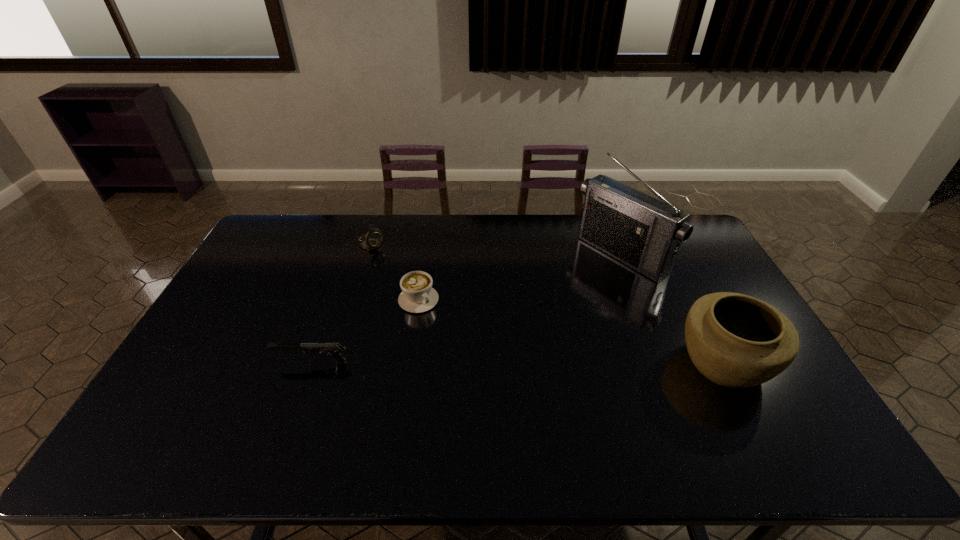
This screenshot has height=540, width=960. I want to click on object that is at the near edge, so click(735, 340).

Find the location of `object situated at the right edge`. object situated at the right edge is located at coordinates (735, 340).

Locate an element on the screen. This screenshot has width=960, height=540. object situated at the near right corner is located at coordinates (735, 340).

This screenshot has height=540, width=960. Find the location of `blank space at the far edge of the desktop`. blank space at the far edge of the desktop is located at coordinates (329, 226).

At what (x,y) coordinates should I click in order to perform the action: click on vacant space at the near edge of the desktop. Please return your answer as a coordinate pair (x, y). This screenshot has width=960, height=540. Looking at the image, I should click on (370, 403).

Locate an element on the screen. This screenshot has height=540, width=960. free region at the left edge of the desktop is located at coordinates (253, 256).

Locate an element on the screen. This screenshot has height=540, width=960. free space at the far right corner is located at coordinates (698, 249).

Find the location of `vacant space at the near right corner of the desktop`. vacant space at the near right corner of the desktop is located at coordinates (770, 415).

Where is `free space between the compass and the gun`? Image resolution: width=960 pixels, height=540 pixels. free space between the compass and the gun is located at coordinates (342, 303).

At what (x,y) coordinates should I click in order to perform the action: click on free space between the tallest object and the fourth shortest object. Please return your answer as a coordinate pair (x, y). The height and width of the screenshot is (540, 960). Looking at the image, I should click on (672, 309).